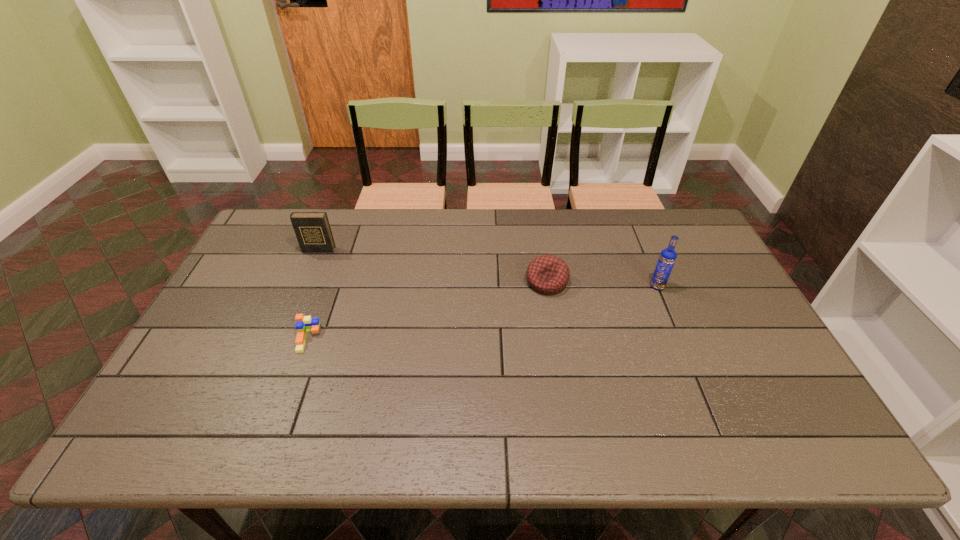
Find the location of a particular element. The image size is (960, 540). vacant region between the nearest object and the farthest object is located at coordinates (313, 294).

At what (x,y) coordinates should I click in order to perform the action: click on vacant point located between the third object from left to right and the diary. Please return your answer as a coordinate pair (x, y). The width and height of the screenshot is (960, 540). Looking at the image, I should click on (433, 266).

Where is `free space between the second tallest object and the tallest object`? free space between the second tallest object and the tallest object is located at coordinates (488, 268).

I want to click on empty space that is in between the tallest object and the third object from left to right, so click(x=602, y=284).

This screenshot has height=540, width=960. In order to click on blank region between the third object from left to right and the Lego in this screenshot , I will do `click(427, 310)`.

At what (x,y) coordinates should I click in order to perform the action: click on vacant area that lies between the beanbag and the shortest object. Please return your answer as a coordinate pair (x, y). Looking at the image, I should click on point(427,310).

Identify which object is the second nearest to the shortest object. Please provide its 2D coordinates. Your answer should be formatted as a tuple, i.e. [(x, y)], where the tuple contains the x and y coordinates of a point satisfying the conditions above.

[(547, 274)]

Point out which object is positioned as the nearest to the second tallest object. Please provide its 2D coordinates. Your answer should be formatted as a tuple, i.e. [(x, y)], where the tuple contains the x and y coordinates of a point satisfying the conditions above.

[(304, 324)]

Find the location of a particular element. Image resolution: width=960 pixels, height=540 pixels. free location that satisfies the following two spatial constraints: 1. on the front cover of the second object from right to left; 2. on the right side of the farthest object is located at coordinates (305, 282).

You are a GUI agent. You are given a task and a screenshot of the screen. Output one action in this format:
    pyautogui.click(x=<x>, y=<y>)
    Task: Click on the vacant area in the image that satisfies the following two spatial constraints: 1. on the front cover of the vodka; 2. on the right side of the second tallest object
    Image resolution: width=960 pixels, height=540 pixels.
    Given the screenshot: What is the action you would take?
    pyautogui.click(x=303, y=286)